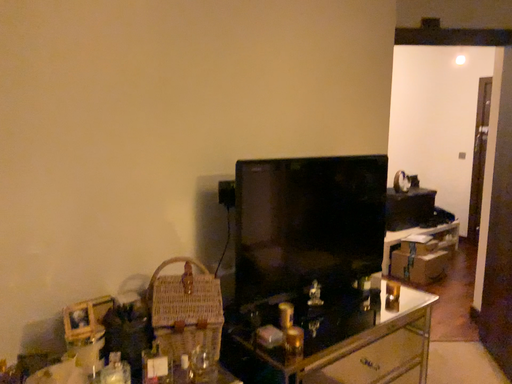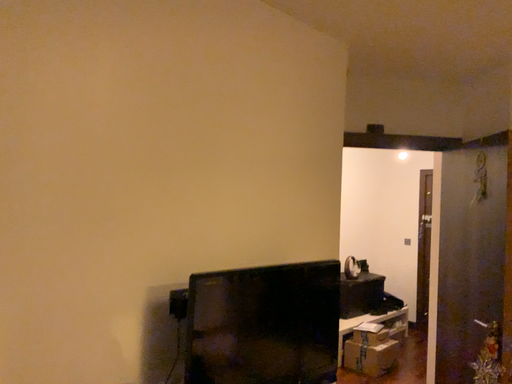
Question: How did the camera likely rotate when shooting the video?

Choices:
 (A) rotated right
 (B) rotated left

Answer: (A)